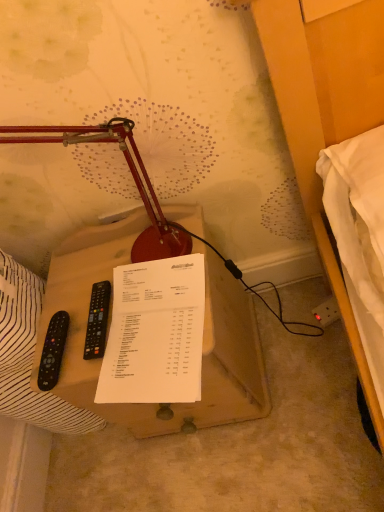
This screenshot has width=384, height=512. What are the coordinates of `vacant space to the right of black plastic remote at left, the second remote control in the right-to-left sequence` in the screenshot? It's located at (117, 315).